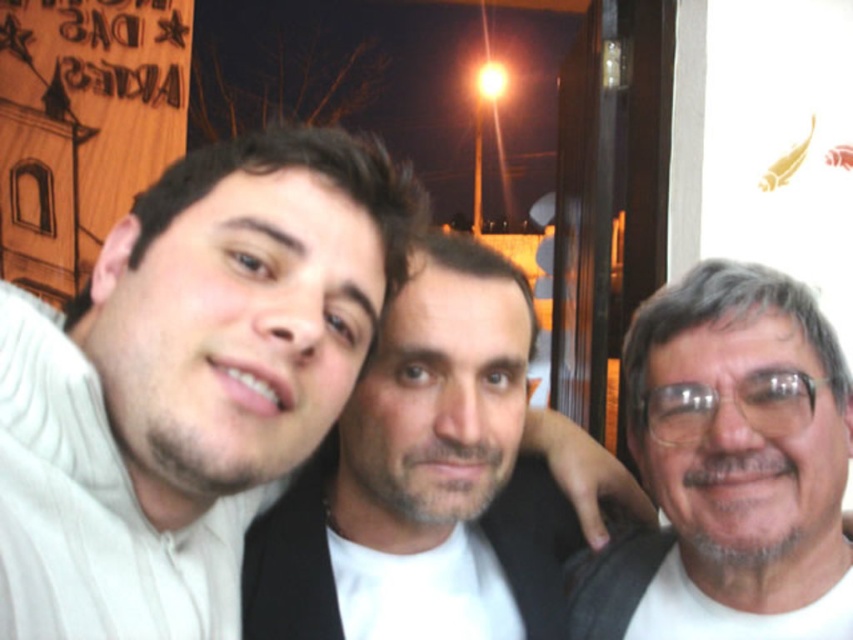
You are a photographer trying to frame a group photo. You need to ensure that the smooth skin face at center and the white matte glasses at right are both visible in the shot. Given their sizes, which object should you prioritize keeping within the frame to avoid cropping?

The smooth skin face at center has a larger width than the white matte glasses at right, so you should prioritize keeping the smooth skin face at center within the frame to avoid cropping.

Based on the scene description and the coordinates provided, which object corresponds to the point at (436, 480)?

The point at (436, 480) corresponds to the smooth skin face at center.

You are trying to locate the white matte sweater at left in the image. According to the coordinates provided, where exactly should you look?

The white matte sweater at left is located at point (187,381).